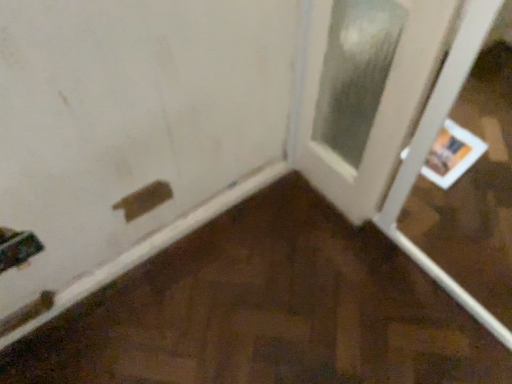
This screenshot has height=384, width=512. Describe the element at coordinates (266, 310) in the screenshot. I see `brown matte plywood at lower left` at that location.

This screenshot has width=512, height=384. Find the location of `brown matte plywood at lower left`. brown matte plywood at lower left is located at coordinates (266, 310).

Is matte white door at lower left, which is counted as the second door, starting from the right, surrounded by brown matte plywood at lower left?

Yes, matte white door at lower left, which is counted as the second door, starting from the right, can be found within brown matte plywood at lower left.

From the image's perspective, who appears lower, brown matte plywood at lower left or matte white door at lower left, which is counted as the second door, starting from the right?

brown matte plywood at lower left.

Considering the sizes of objects brown matte plywood at lower left and matte white door at lower left, which is counted as the second door, starting from the right, in the image provided, who is taller, brown matte plywood at lower left or matte white door at lower left, which is counted as the second door, starting from the right,?

With more height is matte white door at lower left, which is counted as the second door, starting from the right.

Can you tell me how much brown matte plywood at lower left and matte white door at lower left, which is counted as the second door, starting from the right, differ in facing direction?

0.323 degrees.

How different are the orientations of white glossy door at right, which is counted as the 2th door, starting from the left, and matte white door at lower left, which is counted as the second door, starting from the right, in degrees?

The angle between the facing direction of white glossy door at right, which is counted as the 2th door, starting from the left, and the facing direction of matte white door at lower left, which is counted as the second door, starting from the right, is 93.7 degrees.

Does white glossy door at right, which is counted as the 2th door, starting from the left, have a smaller size compared to matte white door at lower left, arranged as the first door when viewed from the left?

Actually, white glossy door at right, which is counted as the 2th door, starting from the left, might be larger than matte white door at lower left, arranged as the first door when viewed from the left.

Is white glossy door at right, which is counted as the 2th door, starting from the left, positioned far away from matte white door at lower left, which is counted as the second door, starting from the right?

Actually, white glossy door at right, which is counted as the 2th door, starting from the left, and matte white door at lower left, which is counted as the second door, starting from the right, are a little close together.

Is white glossy door at right, which is counted as the 2th door, starting from the left, located outside matte white door at lower left, arranged as the first door when viewed from the left?

Absolutely, white glossy door at right, which is counted as the 2th door, starting from the left, is external to matte white door at lower left, arranged as the first door when viewed from the left.

Which of these two, matte white door at lower left, which is counted as the second door, starting from the right, or white glossy door at right, which is counted as the 2th door, starting from the left, is wider?

Wider between the two is white glossy door at right, which is counted as the 2th door, starting from the left.

From a real-world perspective, does matte white door at lower left, which is counted as the second door, starting from the right, stand above white glossy door at right, which is counted as the 2th door, starting from the left?

Yes.

Which is behind, point (32, 206) or point (383, 171)?

Point (383, 171)

How many degrees apart are the facing directions of matte white door at lower left, arranged as the first door when viewed from the left, and white glossy door at right, which is counted as the 2th door, starting from the left?

There is a 93.7-degree angle between the facing directions of matte white door at lower left, arranged as the first door when viewed from the left, and white glossy door at right, which is counted as the 2th door, starting from the left.

From the image's perspective, would you say matte white door at lower left, arranged as the first door when viewed from the left, is shown under brown matte plywood at lower left?

No, from the image's perspective, matte white door at lower left, arranged as the first door when viewed from the left, is not beneath brown matte plywood at lower left.

Where is `plywood in front of the matte white door at lower left, arranged as the first door when viewed from the left`? Image resolution: width=512 pixels, height=384 pixels. plywood in front of the matte white door at lower left, arranged as the first door when viewed from the left is located at coordinates (266, 310).

Is matte white door at lower left, arranged as the first door when viewed from the left, positioned in front of brown matte plywood at lower left?

No, matte white door at lower left, arranged as the first door when viewed from the left, is further to the viewer.

Considering the sizes of objects matte white door at lower left, which is counted as the second door, starting from the right, and brown matte plywood at lower left in the image provided, who is bigger, matte white door at lower left, which is counted as the second door, starting from the right, or brown matte plywood at lower left?

Bigger between the two is brown matte plywood at lower left.

Which object is wider, white glossy door at right, which is the first door from right to left, or brown matte plywood at lower left?

Wider between the two is white glossy door at right, which is the first door from right to left.

Is white glossy door at right, which is counted as the 2th door, starting from the left, to the left of brown matte plywood at lower left from the viewer's perspective?

No.

Which object is further away from the camera taking this photo, white glossy door at right, which is the first door from right to left, or brown matte plywood at lower left?

white glossy door at right, which is the first door from right to left, is further away from the camera.

From a real-world perspective, is brown matte plywood at lower left positioned under white glossy door at right, which is counted as the 2th door, starting from the left, based on gravity?

Actually, brown matte plywood at lower left is physically above white glossy door at right, which is counted as the 2th door, starting from the left, in the real world.

Is brown matte plywood at lower left taller or shorter than white glossy door at right, which is counted as the 2th door, starting from the left?

Clearly, brown matte plywood at lower left is taller compared to white glossy door at right, which is counted as the 2th door, starting from the left.

Is brown matte plywood at lower left thinner than white glossy door at right, which is the first door from right to left?

Yes, brown matte plywood at lower left is thinner than white glossy door at right, which is the first door from right to left.

Consider the image. Can you tell me how much brown matte plywood at lower left and white glossy door at right, which is the first door from right to left, differ in facing direction?

The facing directions of brown matte plywood at lower left and white glossy door at right, which is the first door from right to left, are 93.3 degrees apart.

Locate an element on the screen. plywood lying on the right of matte white door at lower left, which is counted as the second door, starting from the right is located at coordinates (266, 310).

The width and height of the screenshot is (512, 384). What are the coordinates of `door that is below the white glossy door at right, which is the first door from right to left (from the image's perspective)` in the screenshot? It's located at (134, 131).

When comparing their distances from matte white door at lower left, which is counted as the second door, starting from the right, does brown matte plywood at lower left or white glossy door at right, which is counted as the 2th door, starting from the left, seem closer?

white glossy door at right, which is counted as the 2th door, starting from the left, is positioned closer to the anchor matte white door at lower left, which is counted as the second door, starting from the right.

Considering their positions, is white glossy door at right, which is counted as the 2th door, starting from the left, positioned closer to brown matte plywood at lower left than matte white door at lower left, arranged as the first door when viewed from the left?

The object closer to brown matte plywood at lower left is matte white door at lower left, arranged as the first door when viewed from the left.

Estimate the real-world distances between objects in this image. Which object is closer to white glossy door at right, which is the first door from right to left, matte white door at lower left, which is counted as the second door, starting from the right, or brown matte plywood at lower left?

Based on the image, matte white door at lower left, which is counted as the second door, starting from the right, appears to be nearer to white glossy door at right, which is the first door from right to left.

Considering their positions, is white glossy door at right, which is counted as the 2th door, starting from the left, positioned closer to matte white door at lower left, which is counted as the second door, starting from the right, than brown matte plywood at lower left?

Among the two, white glossy door at right, which is counted as the 2th door, starting from the left, is located nearer to matte white door at lower left, which is counted as the second door, starting from the right.

Estimate the real-world distances between objects in this image. Which object is further from brown matte plywood at lower left, matte white door at lower left, which is counted as the second door, starting from the right, or white glossy door at right, which is counted as the 2th door, starting from the left?

Based on the image, white glossy door at right, which is counted as the 2th door, starting from the left, appears to be further to brown matte plywood at lower left.

Looking at the image, which one is located further to white glossy door at right, which is the first door from right to left, brown matte plywood at lower left or matte white door at lower left, which is counted as the second door, starting from the right?

brown matte plywood at lower left.

This screenshot has height=384, width=512. Identify the location of plywood located between matte white door at lower left, arranged as the first door when viewed from the left, and white glossy door at right, which is the first door from right to left, in the left-right direction. (266, 310).